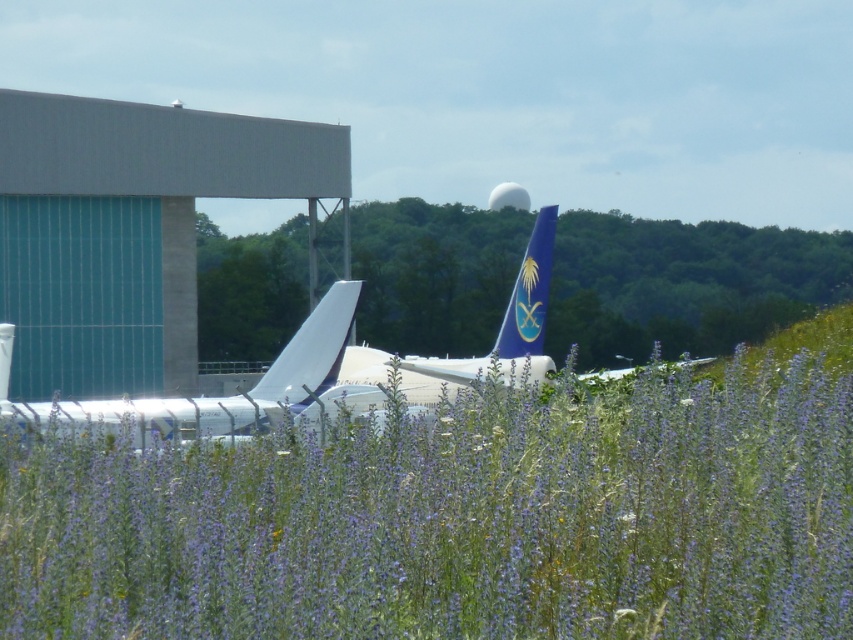
Question: Is purple grass at center to the right of white matte tail at center from the viewer's perspective?

Choices:
 (A) yes
 (B) no

Answer: (A)

Question: Among these points, which one is farthest from the camera?

Choices:
 (A) (670, 563)
 (B) (335, 371)
 (C) (537, 241)

Answer: (C)

Question: Is purple grass at center smaller than blue glossy tail fin at center?

Choices:
 (A) no
 (B) yes

Answer: (B)

Question: Which object is positioned closest to the purple grass at center?

Choices:
 (A) blue glossy tail fin at center
 (B) white matte tail at center
 (C) white glossy airplane at center

Answer: (C)

Question: Which point is farther from the camera taking this photo?

Choices:
 (A) (525, 321)
 (B) (318, 339)

Answer: (A)

Question: Does purple grass at center appear over white matte tail at center?

Choices:
 (A) yes
 (B) no

Answer: (B)